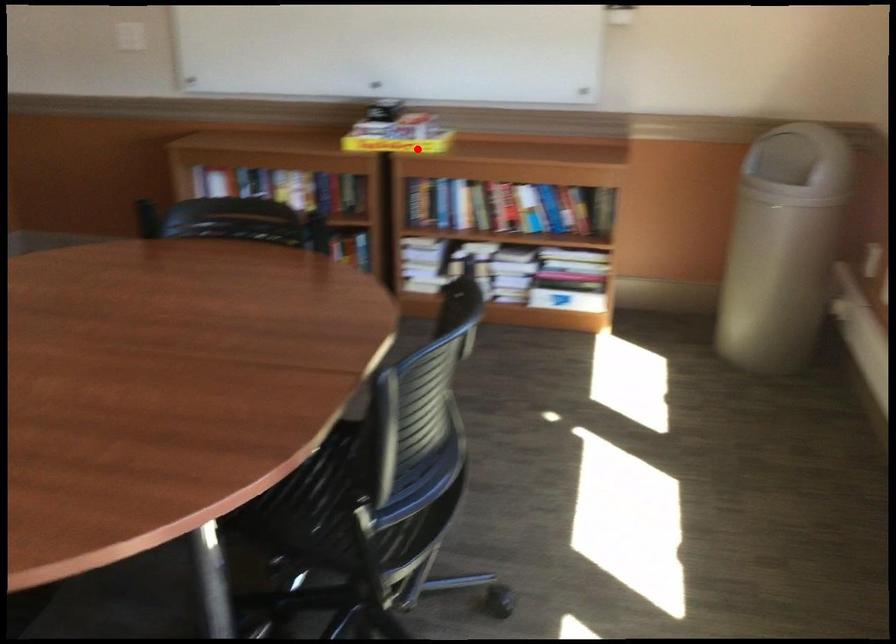
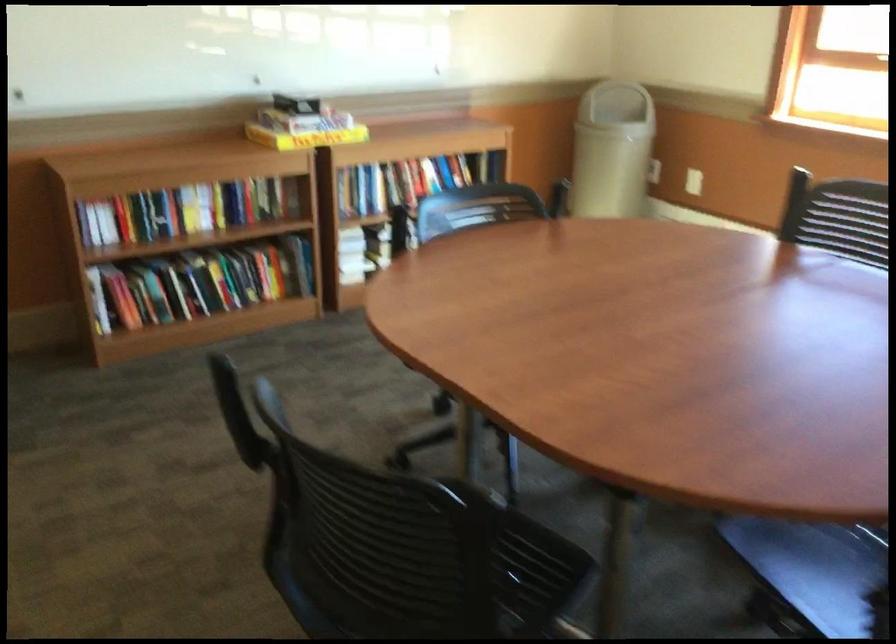
In the second image, find the point that corresponds to the highlighted location in the first image.

(306, 138)